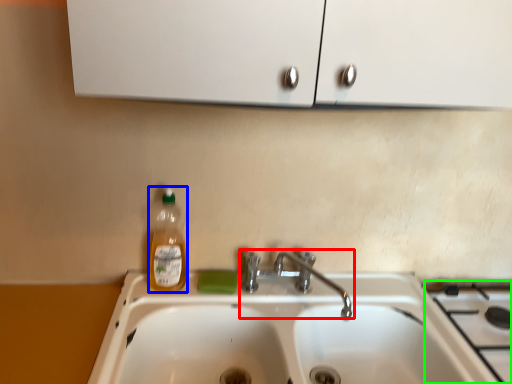
Question: Considering the real-world distances, which object is closest to tap (highlighted by a red box)? bottle (highlighted by a blue box) or gas stove (highlighted by a green box).

Choices:
 (A) bottle
 (B) gas stove

Answer: (A)